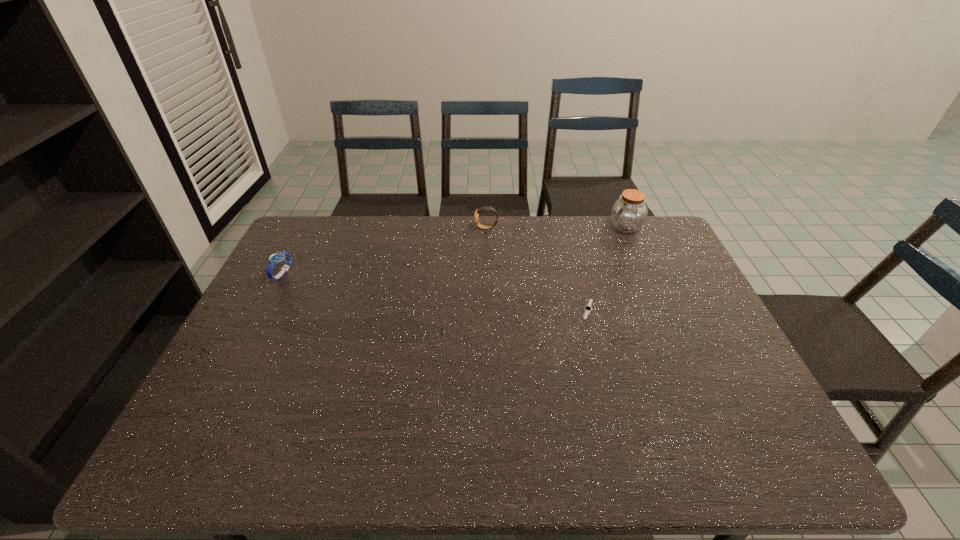
In the image, there is a desktop. Identify the location of free region at the near edge. (432, 465).

The image size is (960, 540). Find the location of `vacant position at the left edge of the desktop`. vacant position at the left edge of the desktop is located at coordinates (261, 377).

Identify the location of vacant space at the right edge. [x=649, y=278].

Locate an element on the screen. Image resolution: width=960 pixels, height=540 pixels. free space that is in between the jar and the leftmost watch is located at coordinates (454, 250).

You are a GUI agent. You are given a task and a screenshot of the screen. Output one action in this format:
    pyautogui.click(x=<x>, y=<y>)
    Task: Click on the vacant area between the jar and the second farthest watch
    This screenshot has width=960, height=540.
    Given the screenshot: What is the action you would take?
    pyautogui.click(x=454, y=250)

Where is `free space between the nearest watch and the leftmost watch`? This screenshot has height=540, width=960. free space between the nearest watch and the leftmost watch is located at coordinates (436, 292).

The height and width of the screenshot is (540, 960). What are the coordinates of `free space that is in between the rightmost object and the second tallest watch` in the screenshot? It's located at (454, 250).

Identify the location of empty space that is in between the rightmost object and the tallest watch. This screenshot has height=540, width=960. (556, 227).

In order to click on free space between the rightmost object and the second watch from right to left in this screenshot , I will do click(556, 227).

This screenshot has height=540, width=960. What are the coordinates of `unoccupied area between the tallest object and the leftmost watch` in the screenshot? It's located at (454, 250).